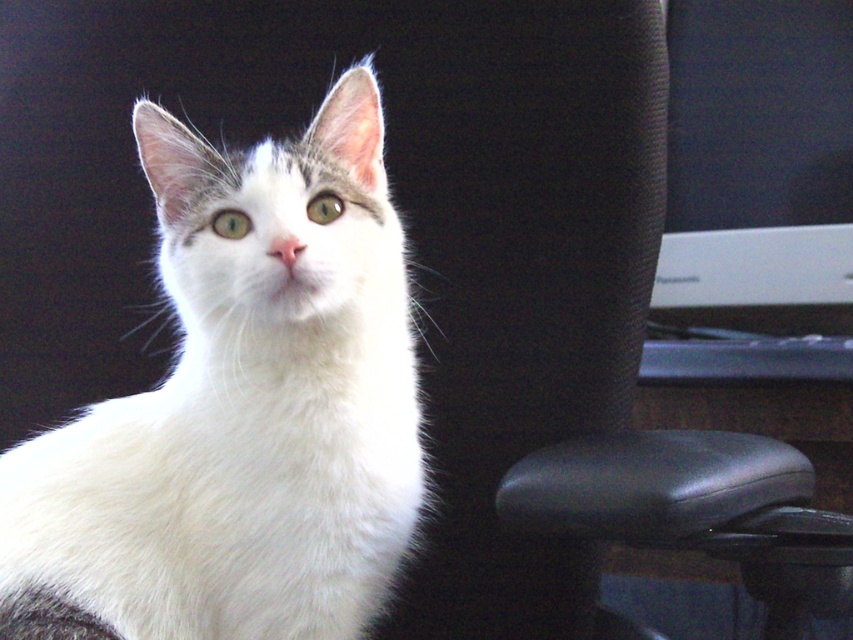
Between white fur cat at center and white plastic monitor at right, which one appears on the left side from the viewer's perspective?

Positioned to the left is white fur cat at center.

Who is more forward, (380, 520) or (670, 20)?

Point (380, 520)

Does point (410, 493) come behind point (695, 307)?

No, (410, 493) is closer to viewer.

This screenshot has height=640, width=853. What are the coordinates of `white fur cat at center` in the screenshot? It's located at (241, 410).